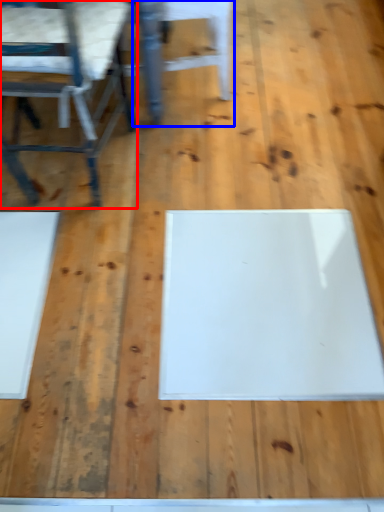
Question: Which object is further to the camera taking this photo, chair (highlighted by a red box) or chair (highlighted by a blue box)?

Choices:
 (A) chair
 (B) chair

Answer: (B)